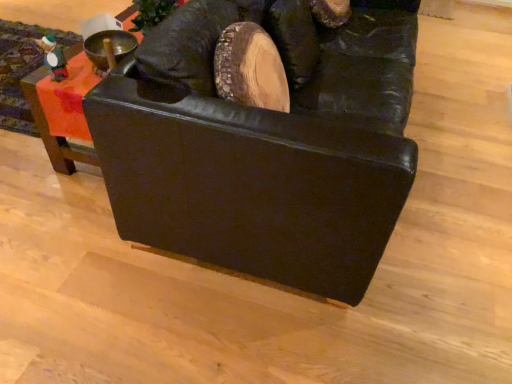
Where is `black leather couch at center, the second furniture in the left-to-right sequence`? The width and height of the screenshot is (512, 384). black leather couch at center, the second furniture in the left-to-right sequence is located at coordinates (265, 145).

Consider the image. Measure the distance between black leather couch at center, which is counted as the first furniture, starting from the right, and camera.

100.00 centimeters.

This screenshot has height=384, width=512. Describe the element at coordinates (265, 145) in the screenshot. I see `black leather couch at center, the second furniture in the left-to-right sequence` at that location.

How much space does matte black couch at upper left, which ranks as the second furniture in right-to-left order, occupy vertically?

1.41 inches.

Identify the location of matte black couch at upper left, which ranks as the second furniture in right-to-left order. This screenshot has height=384, width=512. (53, 135).

What do you see at coordinates (53, 135) in the screenshot? The width and height of the screenshot is (512, 384). I see `matte black couch at upper left, the first furniture positioned from the left` at bounding box center [53, 135].

Identify the location of black leather couch at center, the second furniture in the left-to-right sequence. This screenshot has height=384, width=512. (265, 145).

Is matte black couch at upper left, which ranks as the second furniture in right-to-left order, to the right of black leather couch at center, which is counted as the first furniture, starting from the right, from the viewer's perspective?

Incorrect, matte black couch at upper left, which ranks as the second furniture in right-to-left order, is not on the right side of black leather couch at center, which is counted as the first furniture, starting from the right.

Is matte black couch at upper left, the first furniture positioned from the left, positioned before black leather couch at center, the second furniture in the left-to-right sequence?

That is False.

Which is nearer, (134, 7) or (364, 116)?

The point (364, 116) is closer to the camera.

From the image's perspective, is matte black couch at upper left, the first furniture positioned from the left, located beneath black leather couch at center, which is counted as the first furniture, starting from the right?

No, from the image's perspective, matte black couch at upper left, the first furniture positioned from the left, is not beneath black leather couch at center, which is counted as the first furniture, starting from the right.

From a real-world perspective, is matte black couch at upper left, the first furniture positioned from the left, positioned above or below black leather couch at center, which is counted as the first furniture, starting from the right?

Clearly, from a real-world perspective, matte black couch at upper left, the first furniture positioned from the left, is below black leather couch at center, which is counted as the first furniture, starting from the right.

Which of these two, matte black couch at upper left, which ranks as the second furniture in right-to-left order, or black leather couch at center, the second furniture in the left-to-right sequence, is thinner?

black leather couch at center, the second furniture in the left-to-right sequence.

Considering the sizes of matte black couch at upper left, which ranks as the second furniture in right-to-left order, and black leather couch at center, the second furniture in the left-to-right sequence, in the image, is matte black couch at upper left, which ranks as the second furniture in right-to-left order, taller or shorter than black leather couch at center, the second furniture in the left-to-right sequence,?

Considering their sizes, matte black couch at upper left, which ranks as the second furniture in right-to-left order, has less height than black leather couch at center, the second furniture in the left-to-right sequence.

Based on the photo, between matte black couch at upper left, which ranks as the second furniture in right-to-left order, and black leather couch at center, which is counted as the first furniture, starting from the right, which one has smaller size?

Smaller between the two is matte black couch at upper left, which ranks as the second furniture in right-to-left order.

Is matte black couch at upper left, which ranks as the second furniture in right-to-left order, positioned beyond the bounds of black leather couch at center, the second furniture in the left-to-right sequence?

That's correct, matte black couch at upper left, which ranks as the second furniture in right-to-left order, is outside of black leather couch at center, the second furniture in the left-to-right sequence.

Consider the image. Is matte black couch at upper left, which ranks as the second furniture in right-to-left order, far away from black leather couch at center, which is counted as the first furniture, starting from the right?

They are positioned close to each other.

Does matte black couch at upper left, which ranks as the second furniture in right-to-left order, turn towards black leather couch at center, which is counted as the first furniture, starting from the right?

Yes.

Where is `furniture on the left of black leather couch at center, which is counted as the first furniture, starting from the right`? Image resolution: width=512 pixels, height=384 pixels. furniture on the left of black leather couch at center, which is counted as the first furniture, starting from the right is located at coordinates click(53, 135).

Considering the relative positions of black leather couch at center, which is counted as the first furniture, starting from the right, and matte black couch at upper left, the first furniture positioned from the left, in the image provided, is black leather couch at center, which is counted as the first furniture, starting from the right, to the left of matte black couch at upper left, the first furniture positioned from the left, from the viewer's perspective?

No, black leather couch at center, which is counted as the first furniture, starting from the right, is not to the left of matte black couch at upper left, the first furniture positioned from the left.

Considering the relative positions of black leather couch at center, the second furniture in the left-to-right sequence, and matte black couch at upper left, the first furniture positioned from the left, in the image provided, is black leather couch at center, the second furniture in the left-to-right sequence, in front of matte black couch at upper left, the first furniture positioned from the left,?

Yes, black leather couch at center, the second furniture in the left-to-right sequence, is closer to the viewer.

Does point (246, 2) lie behind point (42, 136)?

That is False.

From the image's perspective, is black leather couch at center, which is counted as the first furniture, starting from the right, beneath matte black couch at upper left, the first furniture positioned from the left?

Yes.

From a real-world perspective, is black leather couch at center, the second furniture in the left-to-right sequence, positioned above or below matte black couch at upper left, which ranks as the second furniture in right-to-left order?

black leather couch at center, the second furniture in the left-to-right sequence, is situated higher than matte black couch at upper left, which ranks as the second furniture in right-to-left order, in the real world.

Is black leather couch at center, the second furniture in the left-to-right sequence, wider or thinner than matte black couch at upper left, the first furniture positioned from the left?

In the image, black leather couch at center, the second furniture in the left-to-right sequence, appears to be more narrow than matte black couch at upper left, the first furniture positioned from the left.

Can you confirm if black leather couch at center, the second furniture in the left-to-right sequence, is shorter than matte black couch at upper left, which ranks as the second furniture in right-to-left order?

No, black leather couch at center, the second furniture in the left-to-right sequence, is not shorter than matte black couch at upper left, which ranks as the second furniture in right-to-left order.

Between black leather couch at center, which is counted as the first furniture, starting from the right, and matte black couch at upper left, which ranks as the second furniture in right-to-left order, which one has smaller size?

matte black couch at upper left, which ranks as the second furniture in right-to-left order.

Is black leather couch at center, the second furniture in the left-to-right sequence, located outside matte black couch at upper left, which ranks as the second furniture in right-to-left order?

Absolutely, black leather couch at center, the second furniture in the left-to-right sequence, is external to matte black couch at upper left, which ranks as the second furniture in right-to-left order.

Are black leather couch at center, which is counted as the first furniture, starting from the right, and matte black couch at upper left, the first furniture positioned from the left, far apart?

They are positioned close to each other.

Is black leather couch at center, the second furniture in the left-to-right sequence, looking in the opposite direction of matte black couch at upper left, the first furniture positioned from the left?

Absolutely, black leather couch at center, the second furniture in the left-to-right sequence, is directed away from matte black couch at upper left, the first furniture positioned from the left.

Where is `furniture on the left of black leather couch at center, the second furniture in the left-to-right sequence`? This screenshot has width=512, height=384. furniture on the left of black leather couch at center, the second furniture in the left-to-right sequence is located at coordinates (53, 135).

Find the location of a particular element. The width and height of the screenshot is (512, 384). furniture above the matte black couch at upper left, the first furniture positioned from the left (from a real-world perspective) is located at coordinates pos(265,145).

Find the location of a particular element. Image resolution: width=512 pixels, height=384 pixels. furniture lying on the right of matte black couch at upper left, which ranks as the second furniture in right-to-left order is located at coordinates (265, 145).